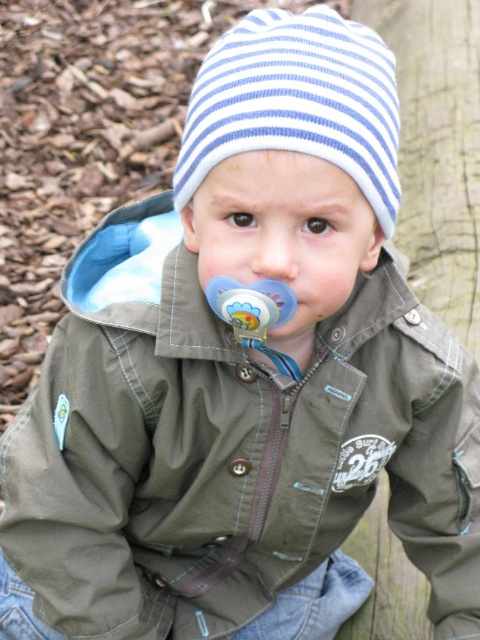
Can you confirm if blue striped knit hat at upper center is taller than blue rubber pacifier at center?

Yes, blue striped knit hat at upper center is taller than blue rubber pacifier at center.

Does point (377, 144) come in front of point (264, 346)?

Yes, point (377, 144) is in front of point (264, 346).

Locate an element on the screen. blue striped knit hat at upper center is located at coordinates (297, 102).

From the picture: Does blue striped knit hat at upper center have a lesser width compared to smooth skin nose at center?

Incorrect, blue striped knit hat at upper center's width is not less than smooth skin nose at center's.

Can you confirm if blue striped knit hat at upper center is bigger than smooth skin nose at center?

Yes, blue striped knit hat at upper center is bigger than smooth skin nose at center.

Describe the element at coordinates (297, 102) in the screenshot. I see `blue striped knit hat at upper center` at that location.

The height and width of the screenshot is (640, 480). What are the coordinates of `blue striped knit hat at upper center` in the screenshot? It's located at (297, 102).

You are a GUI agent. You are given a task and a screenshot of the screen. Output one action in this format:
    pyautogui.click(x=<x>, y=<y>)
    Task: Click on the blue rubber pacifier at center
    
    Given the screenshot: What is the action you would take?
    pyautogui.click(x=254, y=314)

Between point (288, 364) and point (253, 268), which one is positioned in front?

Point (253, 268)

Between point (279, 324) and point (265, 276), which one is positioned behind?

The point (279, 324) is behind.

Where is `blue rubber pacifier at center`? blue rubber pacifier at center is located at coordinates (254, 314).